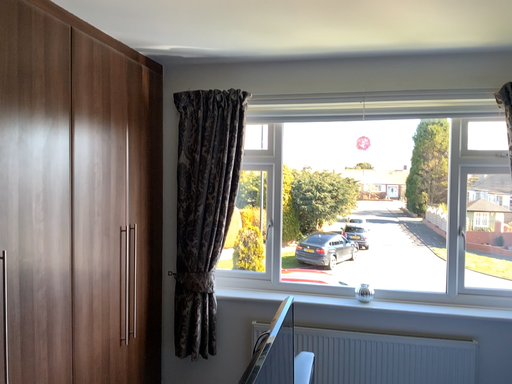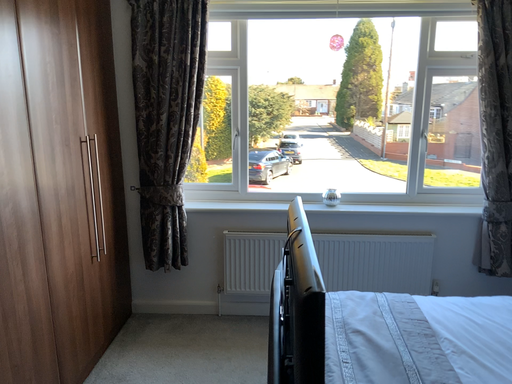
Question: Which way did the camera rotate in the video?

Choices:
 (A) rotated upward
 (B) rotated downward

Answer: (B)